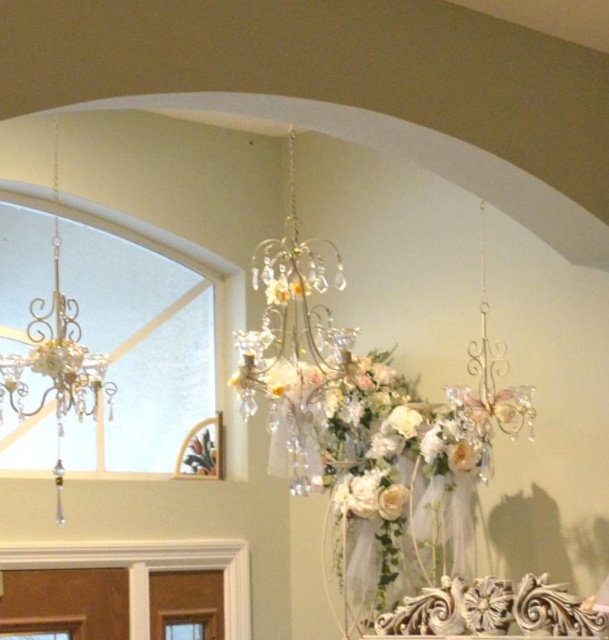
You are an interior designer planning to move the ivory silk floral arrangement at center closer to the silver metallic chandelier at center. Based on their current positions, will the floral arrangement become closer to or farther from the viewer after moving?

The ivory silk floral arrangement at center is currently further to the viewer than the silver metallic chandelier at center. Moving it closer to the chandelier would mean moving it away from the viewer, so it will be farther from the viewer.